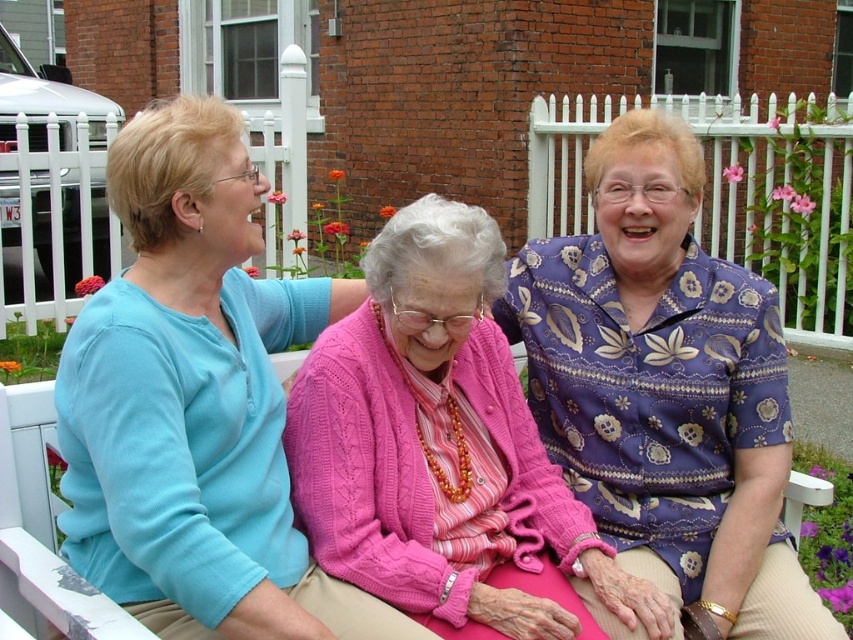
Question: Can you confirm if pink knitted sweater at center is positioned to the left of purple floral shirt at right?

Choices:
 (A) no
 (B) yes

Answer: (B)

Question: Is pink knitted sweater at center to the left of purple floral shirt at right from the viewer's perspective?

Choices:
 (A) yes
 (B) no

Answer: (A)

Question: Which of the following is the closest to the observer?

Choices:
 (A) purple floral shirt at right
 (B) pink knitted sweater at center

Answer: (B)

Question: Does pink knitted sweater at center appear on the right side of purple floral shirt at right?

Choices:
 (A) yes
 (B) no

Answer: (B)

Question: Which point is closer to the camera?

Choices:
 (A) purple floral shirt at right
 (B) pink knitted sweater at center

Answer: (B)